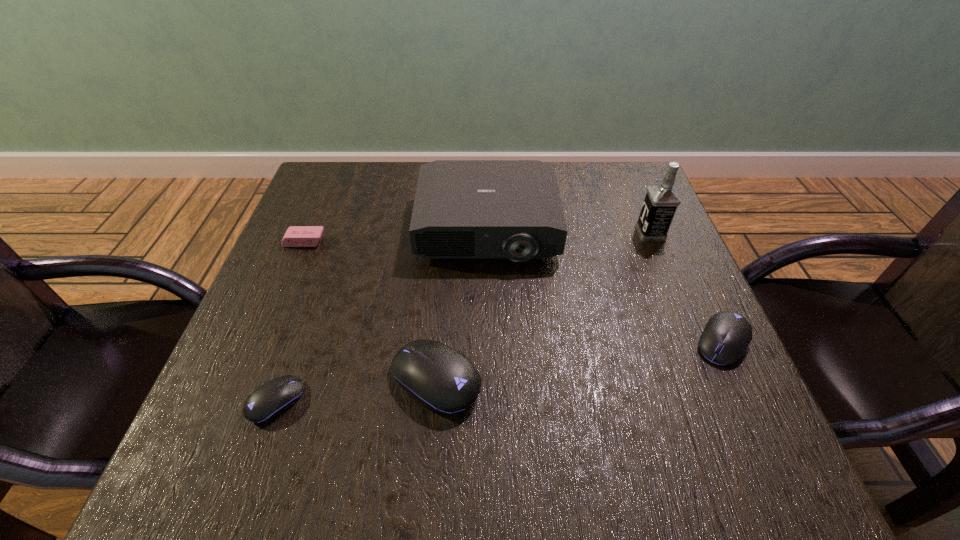
Where is `free space located on the left of the rightmost computer mouse`? This screenshot has width=960, height=540. free space located on the left of the rightmost computer mouse is located at coordinates (479, 342).

I want to click on vacant space located 0.130m on the front-facing side of the projector, so click(x=489, y=313).

Locate an element on the screen. blank area located 0.250m on the front label of the tallest object is located at coordinates (531, 233).

Where is `free space located 0.230m on the front label of the tallest object`? The height and width of the screenshot is (540, 960). free space located 0.230m on the front label of the tallest object is located at coordinates (540, 233).

Locate an element on the screen. vacant space situated 0.240m on the front label of the tallest object is located at coordinates (536, 233).

At what (x,y) coordinates should I click in order to perform the action: click on free point located on the right of the eraser. Please return your answer as a coordinate pair (x, y). The image size is (960, 540). Looking at the image, I should click on (450, 241).

The image size is (960, 540). Identify the location of object that is at the far edge. (512, 209).

What are the coordinates of `computer mouse at the left edge` in the screenshot? It's located at (270, 400).

The height and width of the screenshot is (540, 960). I want to click on eraser at the left edge, so click(x=296, y=236).

Where is `computer mouse present at the right edge`? computer mouse present at the right edge is located at coordinates (726, 336).